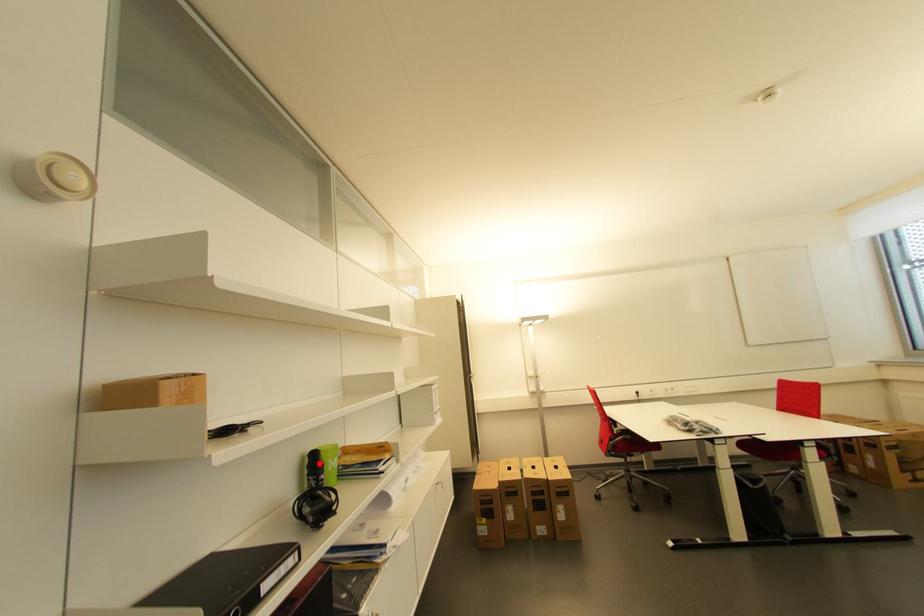
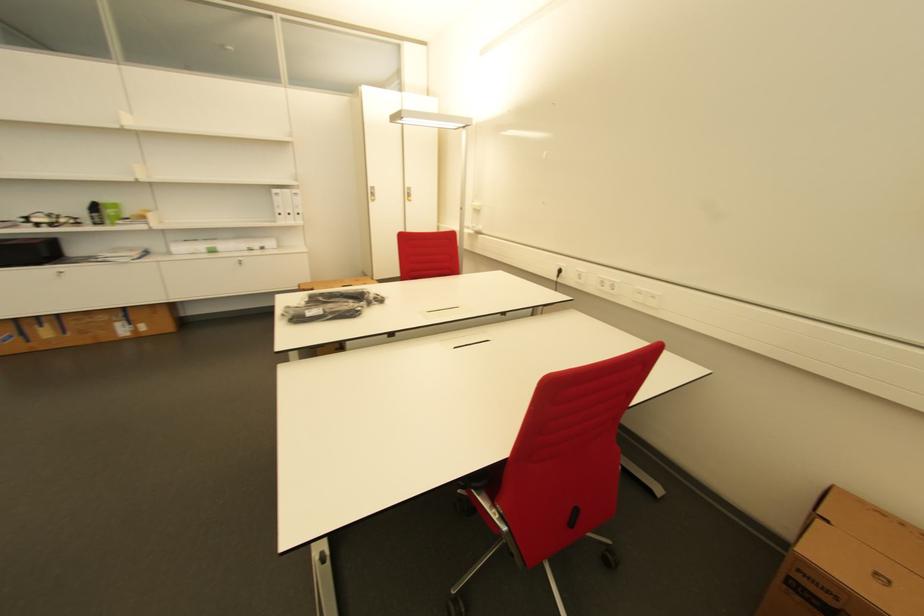
The point at the highlighted location is marked in the first image. Where is the corresponding point in the second image?

(100, 209)